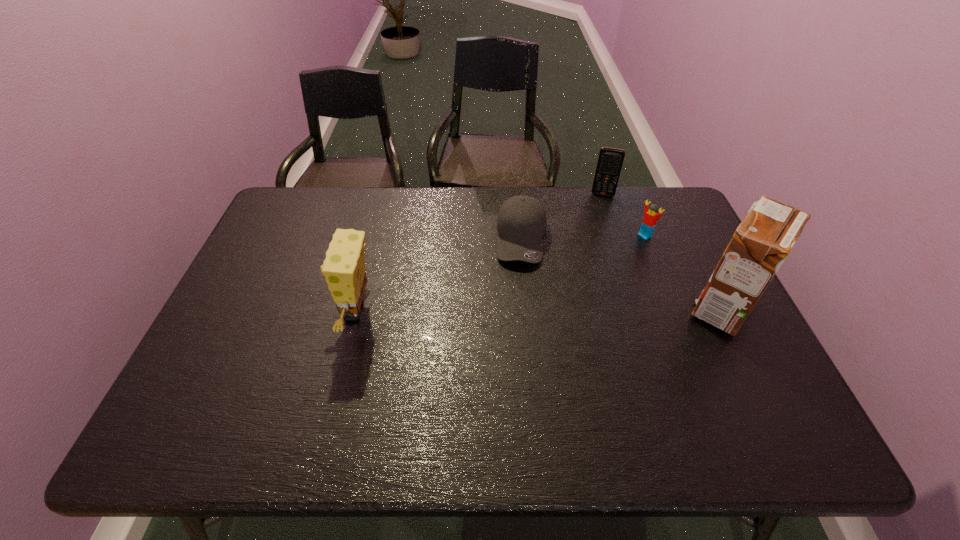
You are a GUI agent. You are given a task and a screenshot of the screen. Output one action in this format:
    pyautogui.click(x=<x>, y=<y>)
    Task: Click on the blank space located on the screen of the third shortest object
    
    Given the screenshot: What is the action you would take?
    pyautogui.click(x=591, y=252)

Identify the location of vacant area situated on the screen of the third shortest object. This screenshot has width=960, height=540. (595, 228).

Image resolution: width=960 pixels, height=540 pixels. I want to click on vacant region located on the screen of the third shortest object, so click(588, 275).

I want to click on baseball cap present at the far edge, so coord(521,224).

Locate an element on the screen. Lego situated at the far edge is located at coordinates (649, 221).

This screenshot has width=960, height=540. What are the coordinates of `cellular telephone that is at the far edge` in the screenshot? It's located at (610, 160).

Locate an element on the screen. carton situated at the right edge is located at coordinates (764, 239).

The width and height of the screenshot is (960, 540). I want to click on Lego that is at the right edge, so click(x=649, y=221).

Find the location of a particular element. This screenshot has width=960, height=540. object present at the far right corner is located at coordinates (649, 221).

This screenshot has height=540, width=960. Find the location of `free region at the far edge of the desktop`. free region at the far edge of the desktop is located at coordinates (381, 220).